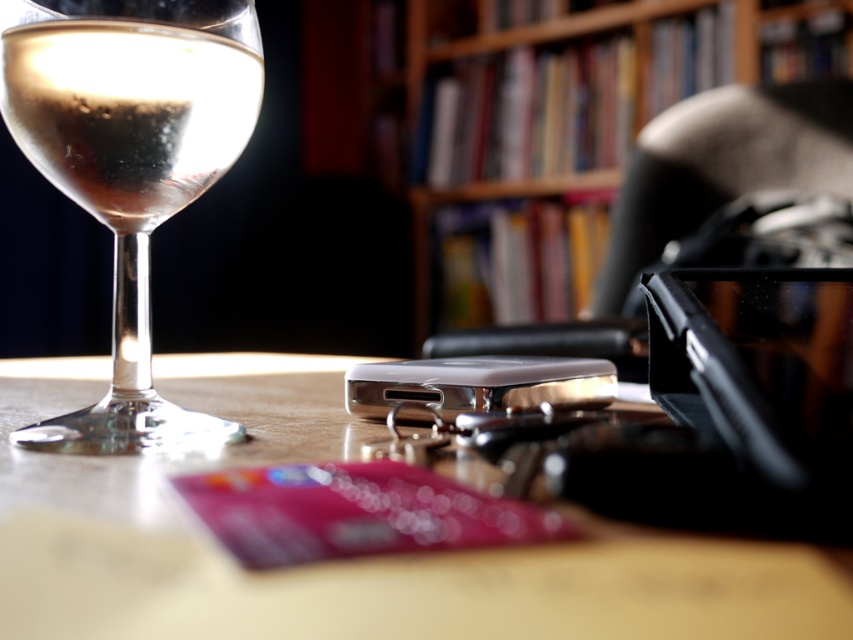
Question: Does wooden bookcase at upper center have a larger size compared to clear glass wine at left?

Choices:
 (A) no
 (B) yes

Answer: (B)

Question: Which object is farther from the camera taking this photo?

Choices:
 (A) clear glass wine glass at left
 (B) clear glass wine at left
 (C) smooth wooden table at center

Answer: (B)

Question: From the image, what is the correct spatial relationship of wooden bookcase at upper center in relation to clear glass wine glass at left?

Choices:
 (A) below
 (B) above

Answer: (B)

Question: Which of these objects is positioned closest to the clear glass wine at left?

Choices:
 (A) wooden bookcase at upper center
 (B) clear glass wine glass at left
 (C) smooth wooden table at center

Answer: (B)

Question: Among these points, which one is farthest from the camera?

Choices:
 (A) (415, 156)
 (B) (62, 109)

Answer: (A)

Question: Can you confirm if smooth wooden table at center is positioned above clear glass wine at left?

Choices:
 (A) no
 (B) yes

Answer: (A)